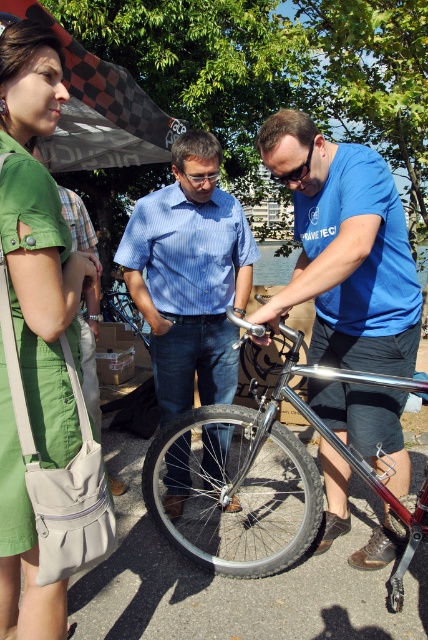
You are a photographer trying to capture a photo of the black rubber tire at center without the green cotton dress at upper left appearing in the frame. Is this possible given their positions?

The green cotton dress at upper left is located above the black rubber tire at center, so adjusting the camera angle downward might exclude the dress from the frame.

You are a photographer standing at the camera position. You want to capture a photo of the green cotton dress at upper left without any people in the frame. Is it possible to do so given the current positions?

The green cotton dress at upper left is 5.28 feet away from the camera, so if there are no people blocking the line of sight between the camera and the dress, it should be possible to take a photo of the green cotton dress at upper left without any people in the frame. However, the description does not mention any obstructions, so we can assume it is possible.

You are a photographer trying to capture a photo of the green cotton dress at upper left and the black rubber tire at center. Which object should you zoom in on to make them appear the same size in the photo?

The green cotton dress at upper left has a lesser width compared to black rubber tire at center, so you should zoom in on the green cotton dress at upper left to make them appear the same size in the photo.